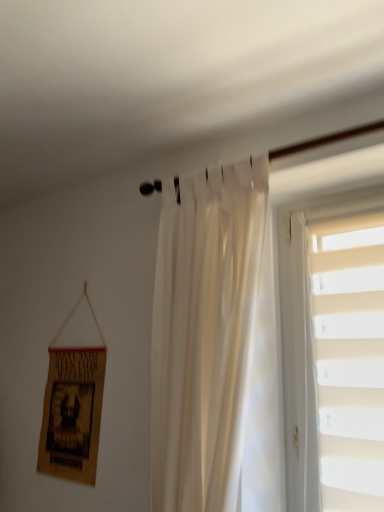
Identify the location of brown cardboard poster at left. (72, 414).

What do you see at coordinates (72, 414) in the screenshot?
I see `brown cardboard poster at left` at bounding box center [72, 414].

Identify the location of brown cardboard poster at left. (72, 414).